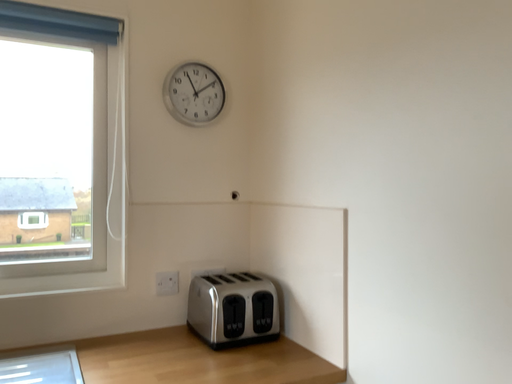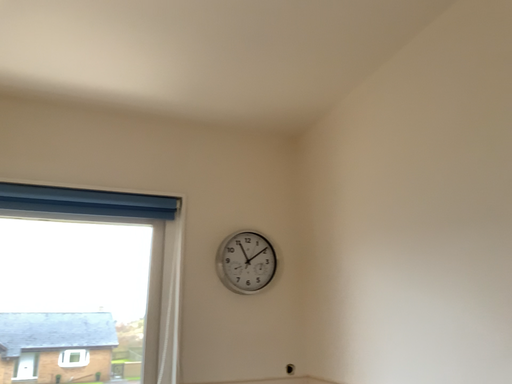
Question: How did the camera likely rotate when shooting the video?

Choices:
 (A) rotated upward
 (B) rotated downward

Answer: (A)